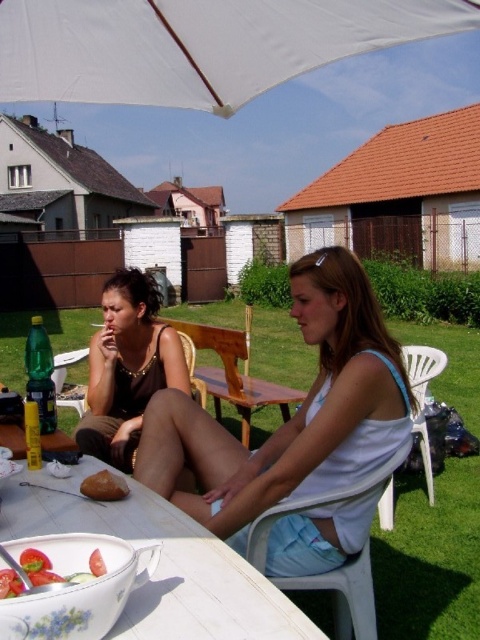
Question: Can you confirm if brown crumbly bread at lower left is positioned to the left of tomato salad at center?

Choices:
 (A) yes
 (B) no

Answer: (A)

Question: Which object is positioned closest to the white fabric umbrella at upper center?

Choices:
 (A) matte black tank top at center
 (B) white glossy table at lower center
 (C) white fabric tank top at center

Answer: (C)

Question: Among these objects, which one is nearest to the camera?

Choices:
 (A) tomato salad at center
 (B) brown crumbly bread at lower left

Answer: (A)

Question: Considering the relative positions of white glossy table at lower center and tomato salad at center in the image provided, where is white glossy table at lower center located with respect to tomato salad at center?

Choices:
 (A) above
 (B) below

Answer: (B)

Question: Does white glossy table at lower center appear under tomato salad at center?

Choices:
 (A) yes
 (B) no

Answer: (A)

Question: Among these points, which one is farthest from the camera?

Choices:
 (A) (147, 38)
 (B) (188, 406)

Answer: (B)